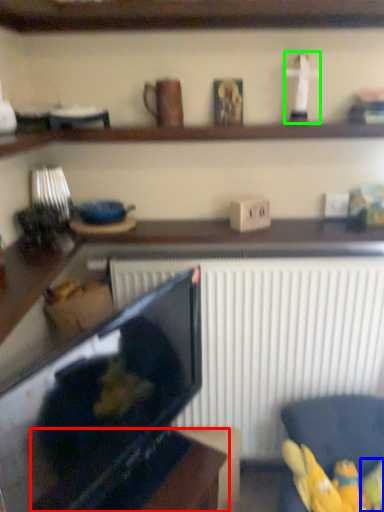
Question: Which is nearer to the table (highlighted by a red box)? toy (highlighted by a blue box) or toy (highlighted by a green box).

Choices:
 (A) toy
 (B) toy

Answer: (A)